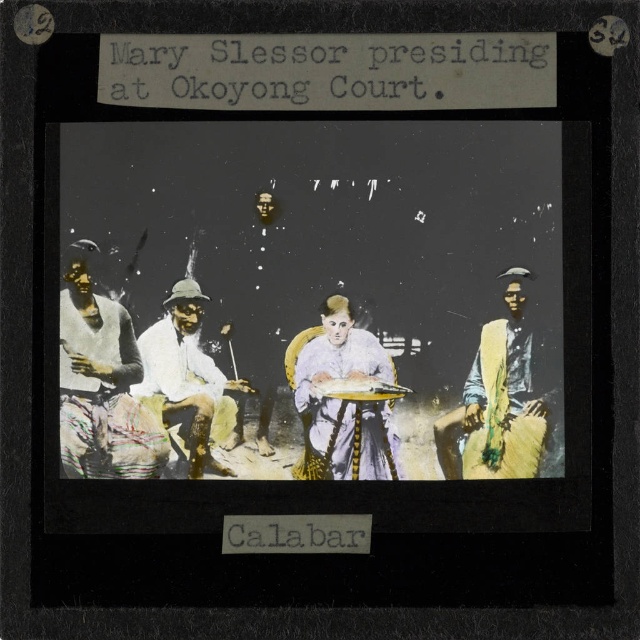
Between white silk dress at center and yellow fabric at right, which one appears on the right side from the viewer's perspective?

yellow fabric at right is more to the right.

What do you see at coordinates (344, 401) in the screenshot?
I see `white silk dress at center` at bounding box center [344, 401].

What are the coordinates of `white silk dress at center` in the screenshot? It's located at (344, 401).

Between point (141, 424) and point (342, 460), which one is positioned in front?

Positioned in front is point (141, 424).

Does white textured fabric at left appear over white silk dress at center?

Yes, white textured fabric at left is above white silk dress at center.

Is point (129, 314) positioned after point (316, 346)?

No, it is in front of (316, 346).

You are a GUI agent. You are given a task and a screenshot of the screen. Output one action in this format:
    pyautogui.click(x=<x>, y=<y>)
    Task: Click on the white textured fabric at left
    
    Given the screenshot: What is the action you would take?
    pyautogui.click(x=100, y=387)

The height and width of the screenshot is (640, 640). In order to click on white silk dress at center in this screenshot , I will do `click(344, 401)`.

Who is more forward, [307,408] or [196,397]?

Point [196,397]

Is point (358, 403) in front of point (176, 332)?

That is True.

At what (x,y) coordinates should I click in order to perform the action: click on white silk dress at center. Please return your answer as a coordinate pair (x, y). The image size is (640, 640). Looking at the image, I should click on (344, 401).